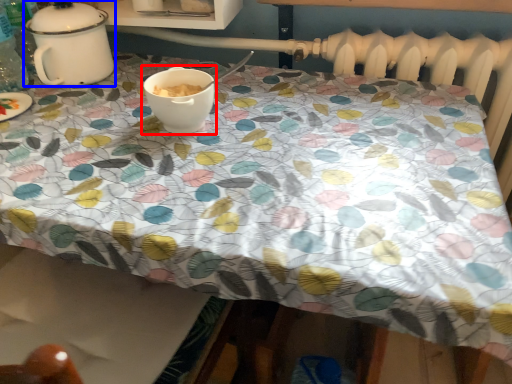
Question: Which point is closer to the camera, coffee cup (highlighted by a red box) or tableware (highlighted by a blue box)?

Choices:
 (A) coffee cup
 (B) tableware

Answer: (A)